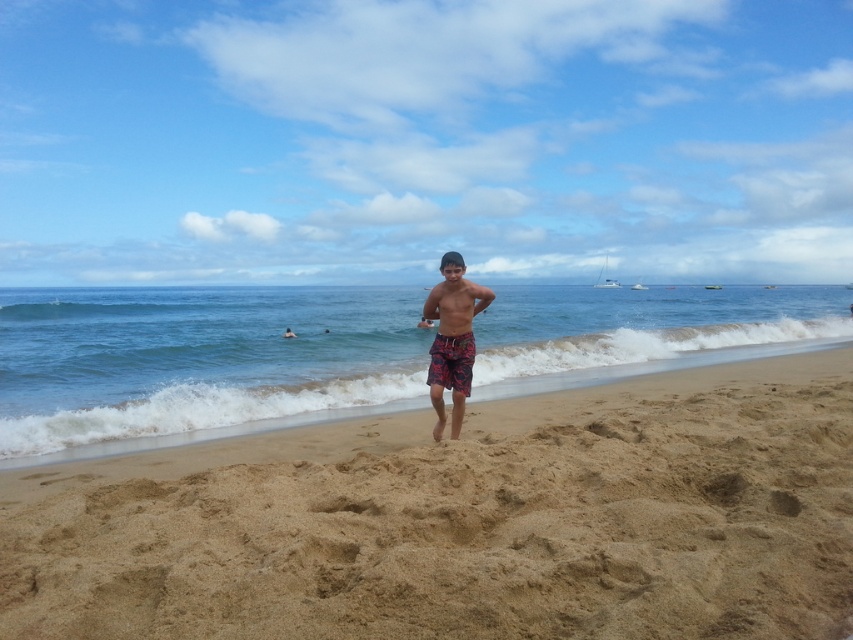
You are a photographer trying to capture both the floral cotton shorts at center and the printed fabric shorts at center in a single shot. Since both are at the center, which one do you need to focus on first to ensure it is in sharp focus?

The floral cotton shorts at center is in front of the printed fabric shorts at center, so you should focus on the floral cotton shorts at center first to ensure it is in sharp focus.